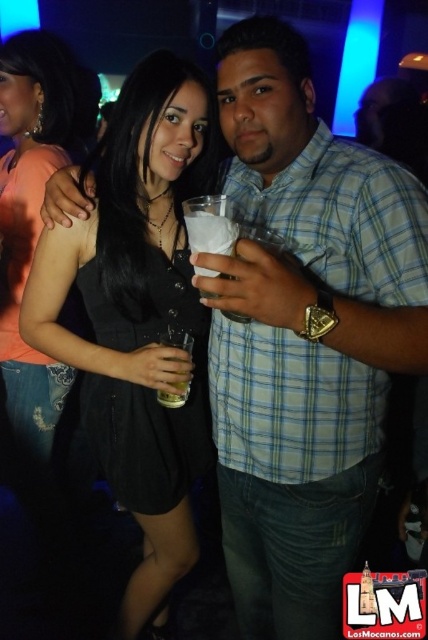
Question: Which point appears farthest from the camera in this image?

Choices:
 (A) (202, 449)
 (B) (290, 36)

Answer: (A)

Question: Which point is farther to the camera?

Choices:
 (A) (234, 225)
 (B) (192, 129)

Answer: (B)

Question: Where is blue plaid shirt at center located in relation to black matte dress at center in the image?

Choices:
 (A) below
 (B) above

Answer: (B)

Question: Is black matte dress at center bigger than clear plastic cup at center?

Choices:
 (A) yes
 (B) no

Answer: (A)

Question: Does blue plaid shirt at center have a greater width compared to black matte dress at center?

Choices:
 (A) yes
 (B) no

Answer: (B)

Question: Which is nearer to the blue plaid shirt at center?

Choices:
 (A) black matte dress at center
 (B) clear plastic cup at center

Answer: (A)